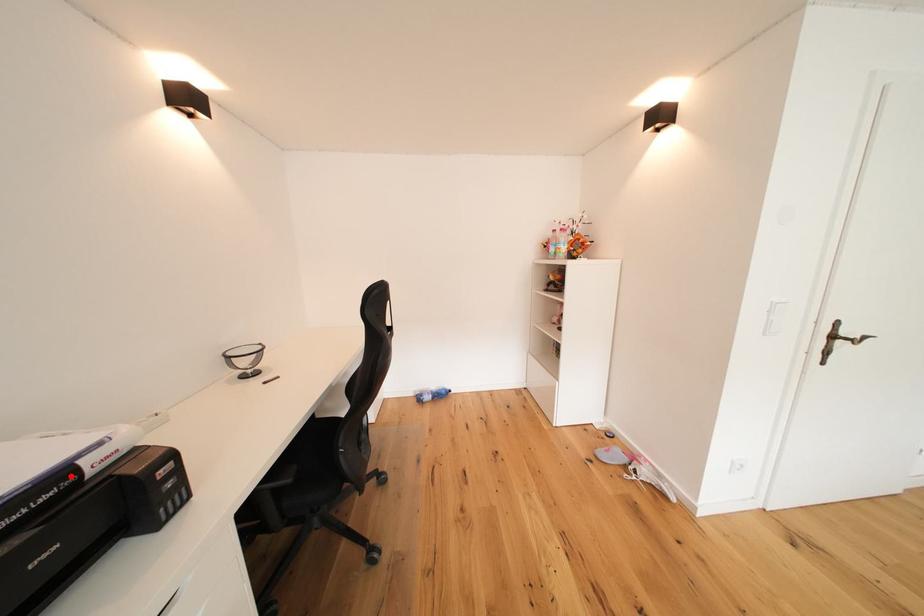
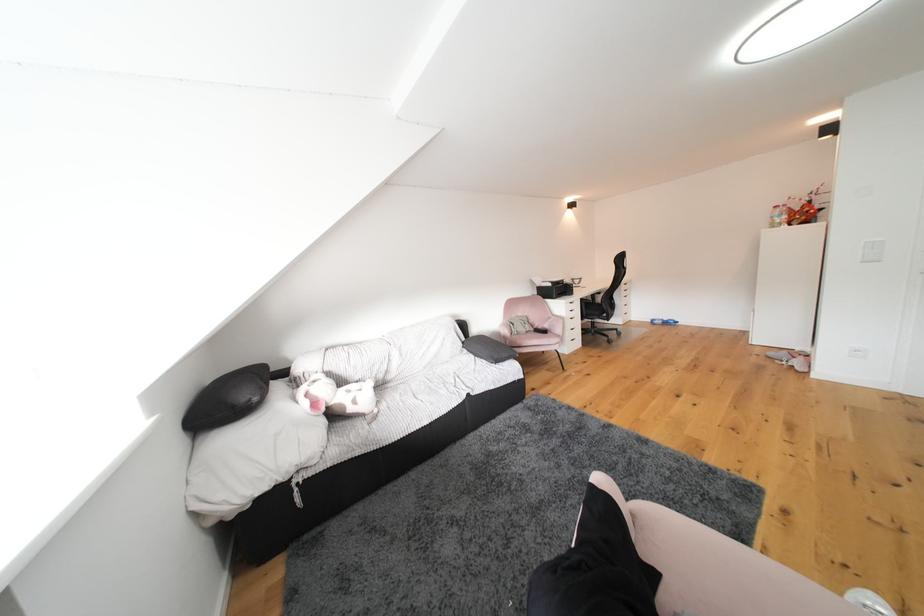
Question: I am providing you with two images of the same scene from different viewpoints. A red point is marked on the first image. Is the red point's position out of view in image 2?

Choices:
 (A) Yes
 (B) No

Answer: (B)